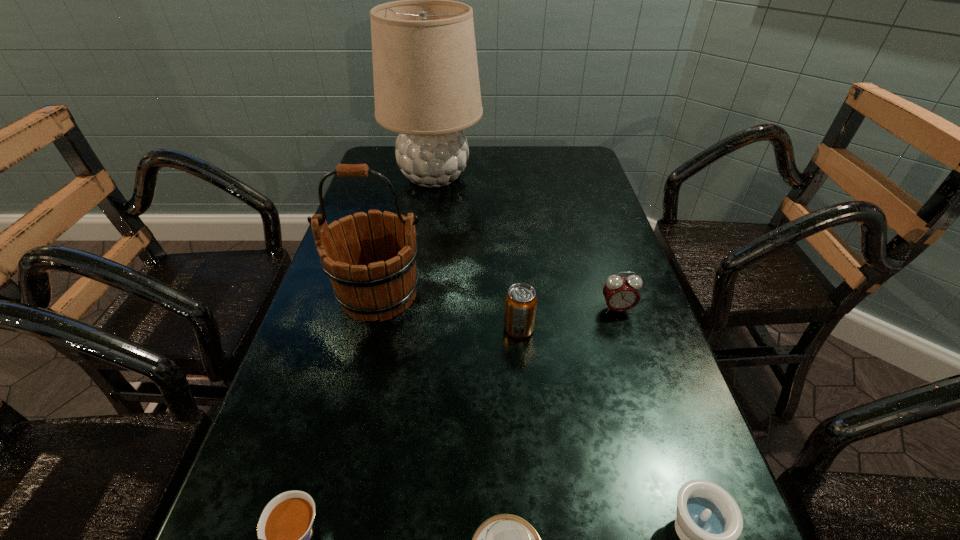
Identify the location of the farthest object. (426, 82).

At what (x,y) coordinates should I click in order to perform the action: click on the tallest object. Please return your answer as a coordinate pair (x, y). This screenshot has height=540, width=960. Looking at the image, I should click on (426, 82).

Find the location of a particular element. This screenshot has height=540, width=960. the sixth shortest object is located at coordinates (375, 278).

Locate an element on the screen. alarm clock is located at coordinates (621, 294).

Image resolution: width=960 pixels, height=540 pixels. Find the location of `soda can`. soda can is located at coordinates (x=520, y=301).

At what (x,y) coordinates should I click in order to perform the action: click on blank space located on the front of the farthest object. Please return your answer as a coordinate pair (x, y). Image resolution: width=960 pixels, height=540 pixels. Looking at the image, I should click on (428, 212).

This screenshot has height=540, width=960. What are the coordinates of `blank space located on the back of the wine bucket` in the screenshot? It's located at (390, 252).

Find the location of a particular element. vacant space situated 0.340m on the clock face of the alarm clock is located at coordinates (668, 471).

The width and height of the screenshot is (960, 540). Find the location of `free space located on the front of the soda can`. free space located on the front of the soda can is located at coordinates (525, 400).

This screenshot has height=540, width=960. I want to click on object situated at the far edge, so click(x=426, y=82).